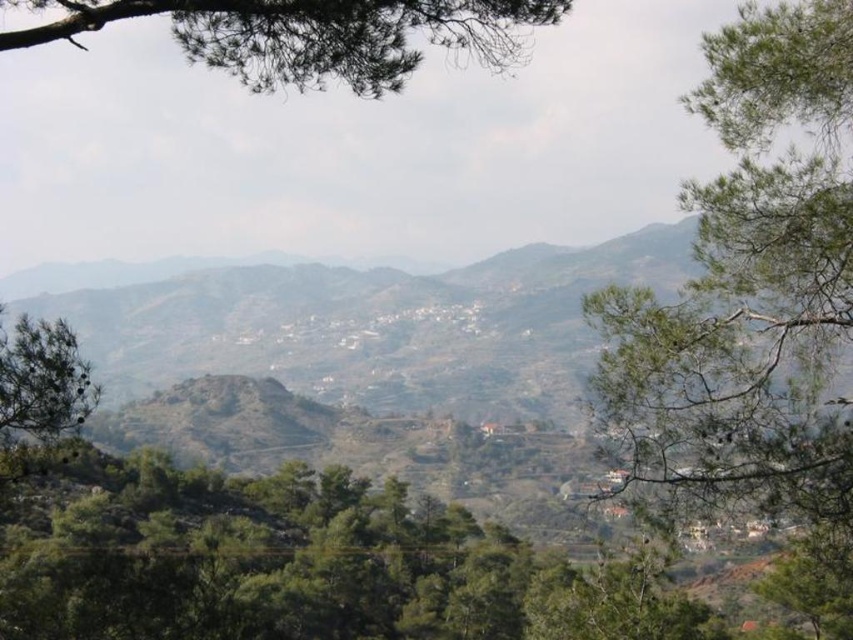
Question: Does green needle-like leaves at upper center appear over green textured pine tree at left?

Choices:
 (A) no
 (B) yes

Answer: (B)

Question: Which point appears farthest from the camera in this image?

Choices:
 (A) (287, 326)
 (B) (357, 20)
 (C) (93, 403)

Answer: (A)

Question: Which of these objects is positioned farthest from the green leafy tree at right?

Choices:
 (A) green needle-like leaves at upper center
 (B) brown rocky mountain at center

Answer: (B)

Question: Does green leafy tree at right have a smaller size compared to green textured pine tree at left?

Choices:
 (A) yes
 (B) no

Answer: (A)

Question: Is green leafy tree at center in front of green leafy tree at right?

Choices:
 (A) no
 (B) yes

Answer: (A)

Question: Among these points, which one is farthest from the camera?

Choices:
 (A) (700, 259)
 (B) (387, 458)
 (C) (202, 548)

Answer: (B)